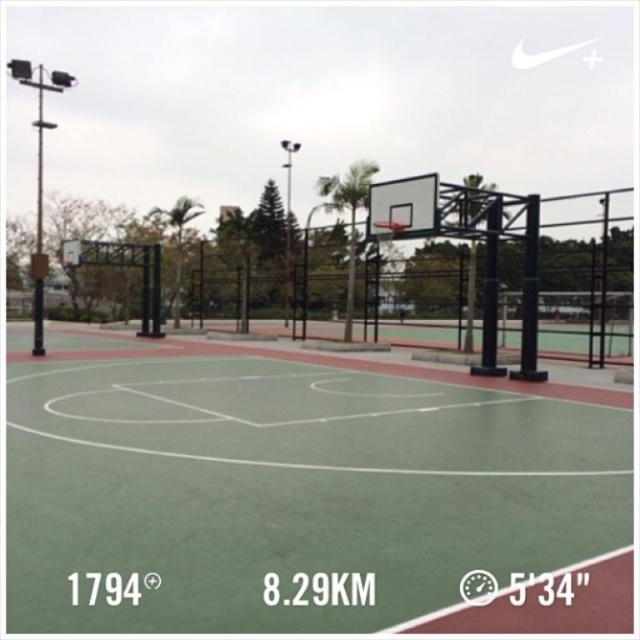
Question: Which of the following is the farthest from the observer?

Choices:
 (A) (561, 477)
 (B) (536, 378)

Answer: (B)

Question: Can you confirm if green rubber basketball court at center is positioned to the right of metallic silver basketball hoop at center?

Choices:
 (A) no
 (B) yes

Answer: (A)

Question: Is green rubber basketball court at center above metallic silver basketball hoop at center?

Choices:
 (A) yes
 (B) no

Answer: (B)

Question: Can you confirm if green rubber basketball court at center is bigger than metallic silver basketball hoop at center?

Choices:
 (A) no
 (B) yes

Answer: (A)

Question: Which point appears farthest from the camera in this image?

Choices:
 (A) (387, 428)
 (B) (522, 365)

Answer: (B)